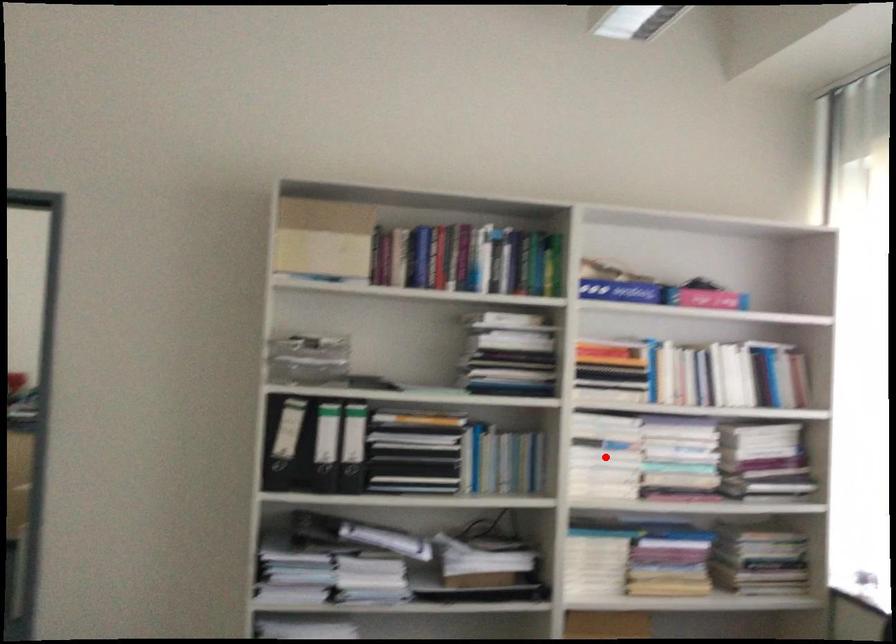
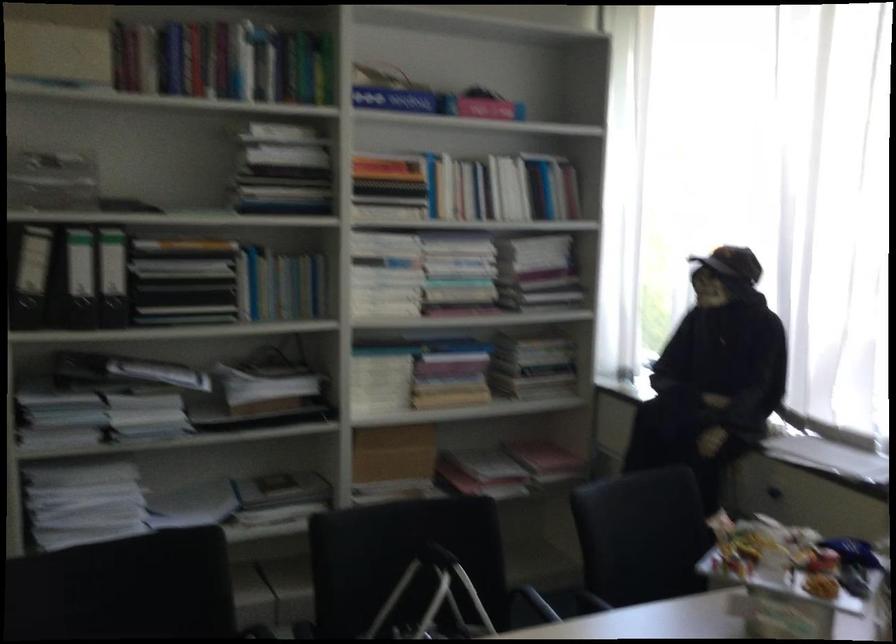
Locate, in the second image, the point that corresponds to the highlighted location in the first image.

(385, 274)